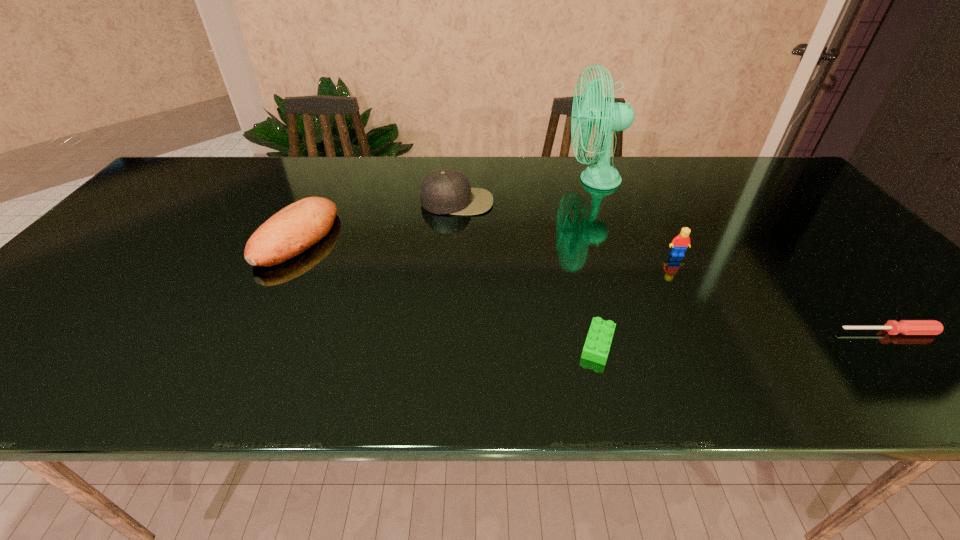
You are a GUI agent. You are given a task and a screenshot of the screen. Output one action in this format:
    pyautogui.click(x=<x>, y=<y>)
    Task: Click on the unoccupied position between the second object from left to right and the second shortest object
    The width and height of the screenshot is (960, 540).
    Given the screenshot: What is the action you would take?
    pyautogui.click(x=527, y=273)

Image resolution: width=960 pixels, height=540 pixels. I want to click on vacant point located between the fifth shortest object and the shorter Lego, so [x=527, y=273].

The width and height of the screenshot is (960, 540). I want to click on free space that is in between the fifth tallest object and the shortest object, so click(743, 338).

Find the location of `blank region between the leftmost object and the shortest object`. blank region between the leftmost object and the shortest object is located at coordinates (592, 285).

Image resolution: width=960 pixels, height=540 pixels. What are the coordinates of `vacant region between the shortest object and the left Lego` in the screenshot? It's located at (743, 338).

Locate which object is the closest to the second object from right to left. Please provide its 2D coordinates. Your answer should be formatted as a tuple, i.e. [(x, y)], where the tuple contains the x and y coordinates of a point satisfying the conditions above.

[(610, 117)]

At what (x,y) coordinates should I click in order to perform the action: click on the third closest object to the rightmost object. Please return your answer as a coordinate pair (x, y). The image size is (960, 540). Looking at the image, I should click on (610, 117).

The image size is (960, 540). Identify the location of free location that satisfies the following two spatial constraints: 1. on the brim of the fifth shortest object; 2. on the right side of the shortest object. (447, 332).

At what (x,y) coordinates should I click in order to perform the action: click on vacant space that satisfies the following two spatial constraints: 1. on the brim of the shortest object; 2. on the right side of the second object from left to right. Please return your answer as a coordinate pair (x, y). Looking at the image, I should click on (447, 332).

Locate an element on the screen. vacant position in the image that satisfies the following two spatial constraints: 1. in front of the tallest object to blow air; 2. on the front side of the shorter Lego is located at coordinates (657, 345).